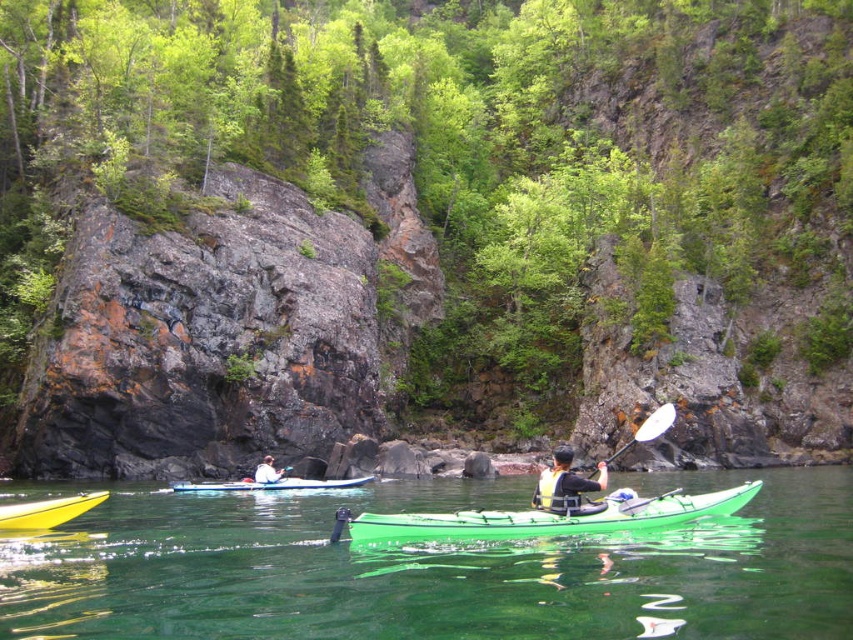
You are planning to transport both the yellow plastic canoe at lower left and the white plastic canoe at center through a low bridge. Which canoe should you carry first to avoid hitting the bridge?

The white plastic canoe at center should be carried first because it has a lower height compared to the yellow plastic canoe at lower left, making it less likely to hit the bridge.